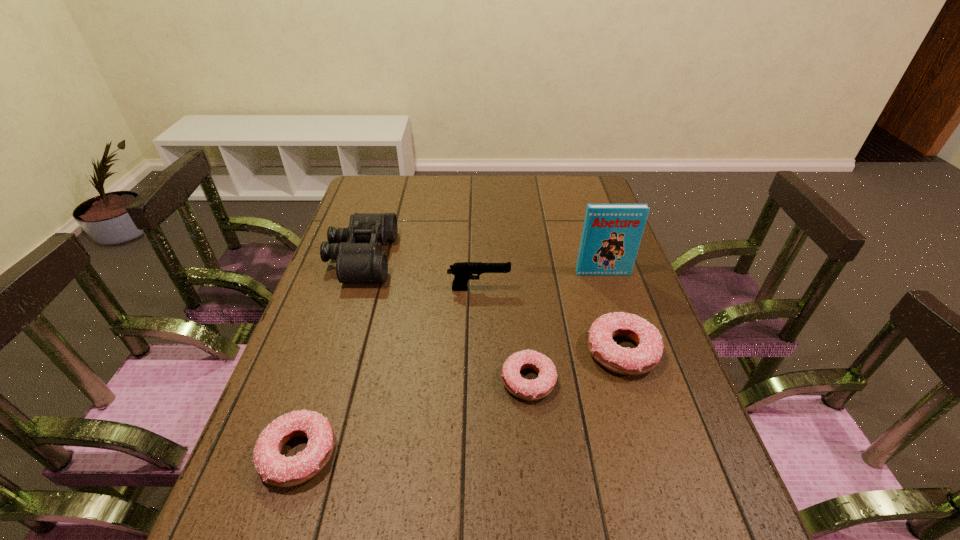
Locate an element on the screen. free space located on the left of the rightmost doughnut is located at coordinates pyautogui.click(x=451, y=352).

This screenshot has height=540, width=960. What are the coordinates of `blank space located 0.280m at the eyepieces of the binoculars` in the screenshot? It's located at (483, 258).

At what (x,y) coordinates should I click in order to perform the action: click on free region located on the front-facing side of the pistol. Please return your answer as a coordinate pair (x, y). This screenshot has width=960, height=540. Looking at the image, I should click on (531, 289).

This screenshot has height=540, width=960. Identify the location of vacant space situated 0.100m on the front cover of the tallest object. (612, 299).

The height and width of the screenshot is (540, 960). What are the coordinates of `object situated at the near edge` in the screenshot? It's located at (275, 469).

You are a GUI agent. You are given a task and a screenshot of the screen. Output one action in this format:
    pyautogui.click(x=<x>, y=<y>)
    Task: Click on the doughnut that is at the left edge
    This screenshot has height=540, width=960.
    Given the screenshot: What is the action you would take?
    pyautogui.click(x=275, y=469)

This screenshot has height=540, width=960. Find the location of `binoculars that is at the left edge`. binoculars that is at the left edge is located at coordinates [357, 249].

Image resolution: width=960 pixels, height=540 pixels. I want to click on doughnut situated at the right edge, so click(645, 357).

The image size is (960, 540). In order to click on book positioned at the right edge in this screenshot , I will do `click(611, 236)`.

I want to click on object located in the near left corner section of the desktop, so [x=275, y=469].